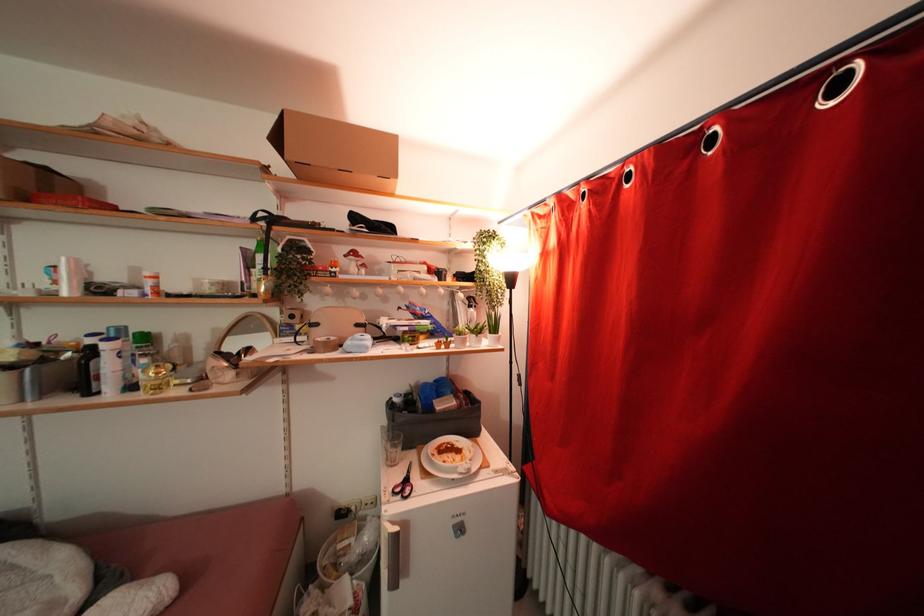
Find where to press the bottle pump dispenser. Please return your answer as a coordinate pair (x, y).

(471, 317)